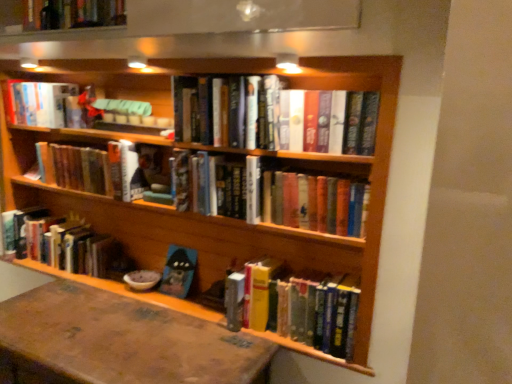
Question: Does hardcover books at center, positioned as the sixth book in bottom-to-top order, have a lesser height compared to hardcover books at center, which is the fourth book in top-to-bottom order?

Choices:
 (A) no
 (B) yes

Answer: (A)

Question: Can you confirm if hardcover books at center, positioned as the sixth book in bottom-to-top order, is wider than hardcover books at center, the fourth book positioned from the bottom?

Choices:
 (A) yes
 (B) no

Answer: (A)

Question: Would you say hardcover books at center, the fourth book positioned from the bottom, is part of hardcover books at center, acting as the second book starting from the top,'s contents?

Choices:
 (A) yes
 (B) no

Answer: (B)

Question: Is hardcover books at center, acting as the second book starting from the top, at the right side of hardcover books at center, the fourth book positioned from the bottom?

Choices:
 (A) yes
 (B) no

Answer: (B)

Question: Does hardcover books at center, positioned as the sixth book in bottom-to-top order, have a greater height compared to hardcover books at center, the fourth book positioned from the bottom?

Choices:
 (A) yes
 (B) no

Answer: (A)

Question: Considering the relative sizes of hardcover books at center, positioned as the sixth book in bottom-to-top order, and hardcover books at center, the fourth book positioned from the bottom, in the image provided, is hardcover books at center, positioned as the sixth book in bottom-to-top order, thinner than hardcover books at center, the fourth book positioned from the bottom,?

Choices:
 (A) no
 (B) yes

Answer: (A)

Question: Considering the relative sizes of hardcover books at center, acting as the second book starting from the top, and brown leather table at lower left in the image provided, is hardcover books at center, acting as the second book starting from the top, smaller than brown leather table at lower left?

Choices:
 (A) yes
 (B) no

Answer: (A)

Question: Is hardcover books at center, positioned as the sixth book in bottom-to-top order, at the left side of brown leather table at lower left?

Choices:
 (A) yes
 (B) no

Answer: (B)

Question: Is hardcover books at center, acting as the second book starting from the top, in contact with brown leather table at lower left?

Choices:
 (A) no
 (B) yes

Answer: (A)

Question: Is hardcover books at center, acting as the second book starting from the top, oriented towards brown leather table at lower left?

Choices:
 (A) no
 (B) yes

Answer: (A)

Question: Is hardcover books at center, positioned as the sixth book in bottom-to-top order, bigger than brown leather table at lower left?

Choices:
 (A) no
 (B) yes

Answer: (A)

Question: From a real-world perspective, does hardcover books at center, acting as the second book starting from the top, sit lower than brown leather table at lower left?

Choices:
 (A) no
 (B) yes

Answer: (A)

Question: Does hardcover book at lower left, the 3th book from the bottom, appear on the left side of hardcover books at center, which is the seventh book from top to bottom?

Choices:
 (A) no
 (B) yes

Answer: (B)